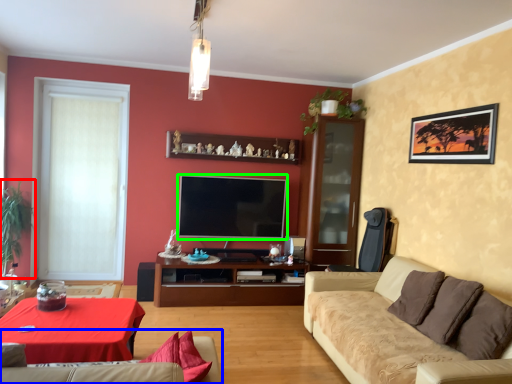
Question: Considering the real-world distances, which object is closest to plant (highlighted by a red box)? studio couch (highlighted by a blue box) or television (highlighted by a green box).

Choices:
 (A) studio couch
 (B) television

Answer: (B)